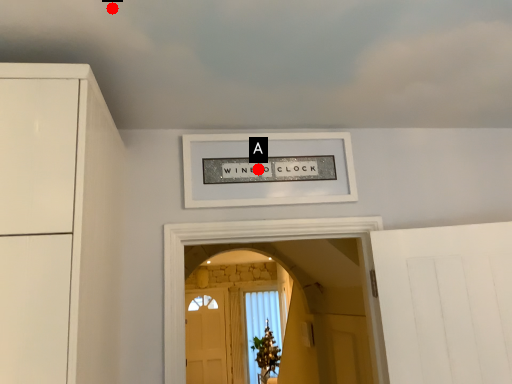
Question: Two points are circled on the image, labeled by A and B beside each circle. Which point is closer to the camera?

Choices:
 (A) A is closer
 (B) B is closer

Answer: (B)